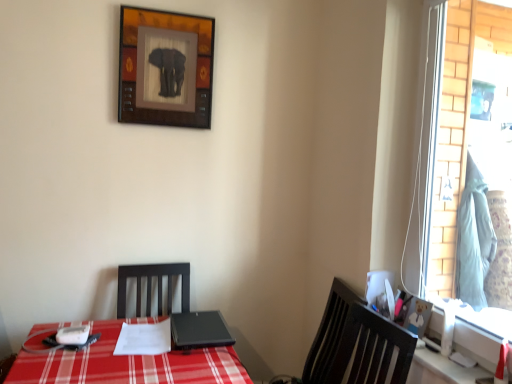
Question: Is wooden bear picture frame at right, the 1th picture frame viewed from the right, behind light blue fabric at right?

Choices:
 (A) no
 (B) yes

Answer: (A)

Question: Does wooden bear picture frame at right, the second picture frame from the left, have a greater height compared to light blue fabric at right?

Choices:
 (A) yes
 (B) no

Answer: (B)

Question: Does wooden bear picture frame at right, the first picture frame in the front-to-back sequence, appear on the left side of light blue fabric at right?

Choices:
 (A) yes
 (B) no

Answer: (A)

Question: Does wooden bear picture frame at right, which appears as the 2th picture frame when viewed from the top, contain light blue fabric at right?

Choices:
 (A) yes
 (B) no

Answer: (B)

Question: Is wooden bear picture frame at right, which is the first picture frame from bottom to top, far from light blue fabric at right?

Choices:
 (A) no
 (B) yes

Answer: (A)

Question: Considering the relative sizes of wooden bear picture frame at right, which appears as the 2th picture frame when viewed from the top, and light blue fabric at right in the image provided, is wooden bear picture frame at right, which appears as the 2th picture frame when viewed from the top, shorter than light blue fabric at right?

Choices:
 (A) yes
 (B) no

Answer: (A)

Question: From the image's perspective, is wooden bear picture frame at right, which appears as the 2th picture frame when viewed from the top, under black matte laptop at center?

Choices:
 (A) no
 (B) yes

Answer: (A)

Question: Does wooden bear picture frame at right, which appears as the 2th picture frame when viewed from the top, have a greater width compared to black matte laptop at center?

Choices:
 (A) no
 (B) yes

Answer: (A)

Question: Is wooden bear picture frame at right, which is the second picture frame from back to front, shorter than black matte laptop at center?

Choices:
 (A) yes
 (B) no

Answer: (B)

Question: Does wooden bear picture frame at right, the first picture frame in the front-to-back sequence, have a larger size compared to black matte laptop at center?

Choices:
 (A) yes
 (B) no

Answer: (B)

Question: Is wooden bear picture frame at right, the first picture frame in the front-to-back sequence, further to the viewer compared to black matte laptop at center?

Choices:
 (A) yes
 (B) no

Answer: (B)

Question: Considering the relative positions of wooden bear picture frame at right, the second picture frame from the left, and black matte laptop at center in the image provided, is wooden bear picture frame at right, the second picture frame from the left, to the right of black matte laptop at center from the viewer's perspective?

Choices:
 (A) no
 (B) yes

Answer: (B)

Question: Is glass window at right taller than light blue fabric at right?

Choices:
 (A) yes
 (B) no

Answer: (A)